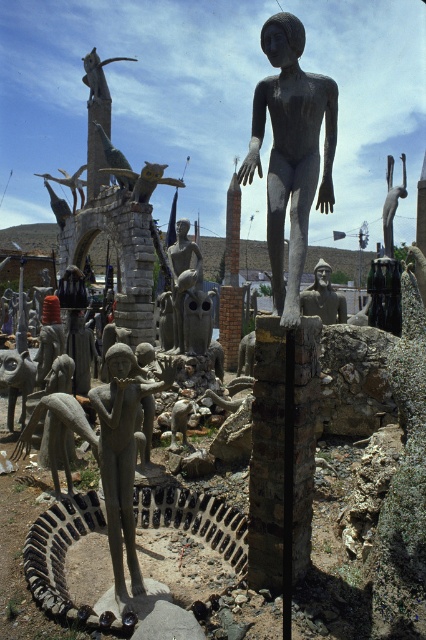
Which is below, bronze statue at center or matte bronze statue at center?

matte bronze statue at center is lower down.

Which of these two, bronze statue at center or matte bronze statue at center, stands shorter?

Standing shorter between the two is matte bronze statue at center.

Describe the element at coordinates (290, 152) in the screenshot. I see `bronze statue at center` at that location.

At what (x,y) coordinates should I click in order to perform the action: click on bronze statue at center. Please return your answer as a coordinate pair (x, y). The image size is (426, 640). Looking at the image, I should click on (290, 152).